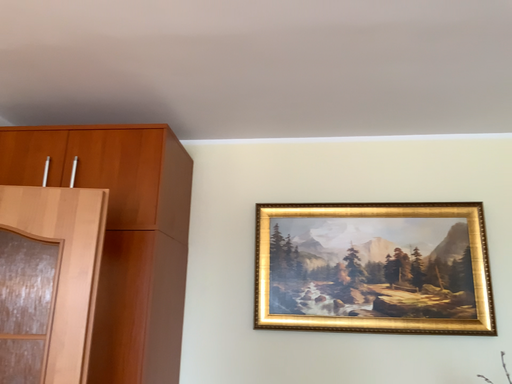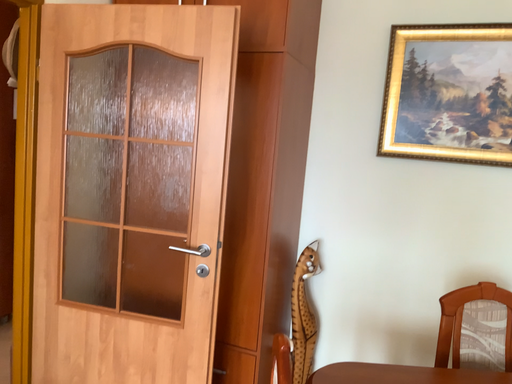
Question: Which way did the camera rotate in the video?

Choices:
 (A) rotated right
 (B) rotated left

Answer: (B)